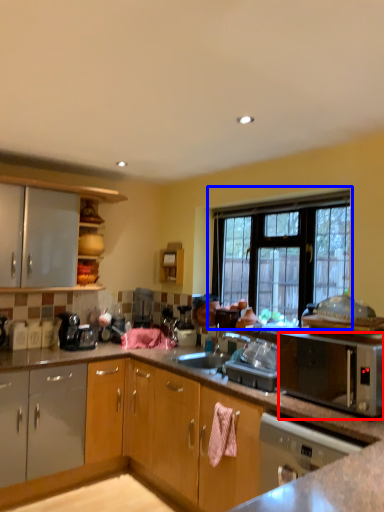
Question: Which point is further to the camera, microwave oven (highlighted by a red box) or window (highlighted by a blue box)?

Choices:
 (A) microwave oven
 (B) window

Answer: (B)